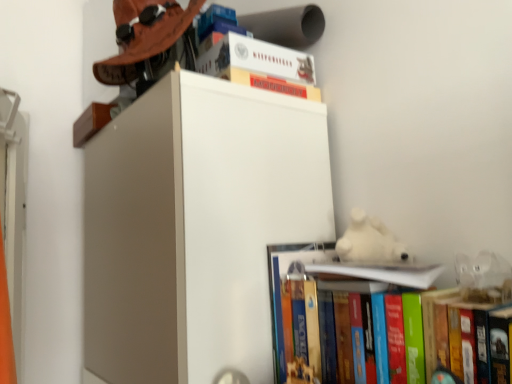
Question: Does hardcover book at lower right, acting as the first book starting from the bottom, have a greater height compared to white paper at upper center, marked as the second book in a bottom-to-top arrangement?

Choices:
 (A) no
 (B) yes

Answer: (B)

Question: Is hardcover book at lower right, acting as the first book starting from the bottom, facing towards white paper at upper center, acting as the second book starting from the top?

Choices:
 (A) yes
 (B) no

Answer: (A)

Question: From the image's perspective, is hardcover book at lower right, which is counted as the third book, starting from the top, on top of white paper at upper center, acting as the second book starting from the top?

Choices:
 (A) yes
 (B) no

Answer: (B)

Question: Considering the relative sizes of hardcover book at lower right, which is counted as the third book, starting from the top, and white paper at upper center, marked as the second book in a bottom-to-top arrangement, in the image provided, is hardcover book at lower right, which is counted as the third book, starting from the top, thinner than white paper at upper center, marked as the second book in a bottom-to-top arrangement,?

Choices:
 (A) yes
 (B) no

Answer: (B)

Question: Can you confirm if hardcover book at lower right, which is counted as the third book, starting from the top, is positioned to the left of white paper at upper center, marked as the second book in a bottom-to-top arrangement?

Choices:
 (A) yes
 (B) no

Answer: (B)

Question: Are hardcover book at lower right, which is counted as the third book, starting from the top, and white paper at upper center, marked as the second book in a bottom-to-top arrangement, far apart?

Choices:
 (A) yes
 (B) no

Answer: (B)

Question: Is matte brown hat at upper left in contact with hardcover book at upper center, the 1th book in the top-to-bottom sequence?

Choices:
 (A) yes
 (B) no

Answer: (A)

Question: Is the depth of matte brown hat at upper left greater than that of hardcover book at upper center, the 1th book in the top-to-bottom sequence?

Choices:
 (A) no
 (B) yes

Answer: (A)

Question: Considering the relative sizes of matte brown hat at upper left and hardcover book at upper center, the 1th book in the top-to-bottom sequence, in the image provided, is matte brown hat at upper left shorter than hardcover book at upper center, the 1th book in the top-to-bottom sequence,?

Choices:
 (A) no
 (B) yes

Answer: (A)

Question: Considering the relative sizes of matte brown hat at upper left and hardcover book at upper center, the 1th book in the top-to-bottom sequence, in the image provided, is matte brown hat at upper left taller than hardcover book at upper center, the 1th book in the top-to-bottom sequence,?

Choices:
 (A) yes
 (B) no

Answer: (A)

Question: Is matte brown hat at upper left smaller than hardcover book at upper center, the 1th book in the top-to-bottom sequence?

Choices:
 (A) yes
 (B) no

Answer: (B)

Question: Considering the relative sizes of matte brown hat at upper left and hardcover book at upper center, arranged as the third book when ordered from the bottom, in the image provided, is matte brown hat at upper left bigger than hardcover book at upper center, arranged as the third book when ordered from the bottom,?

Choices:
 (A) yes
 (B) no

Answer: (A)

Question: Would you say hardcover book at upper center, arranged as the third book when ordered from the bottom, is outside hardcover book at lower right, acting as the first book starting from the bottom?

Choices:
 (A) no
 (B) yes

Answer: (B)